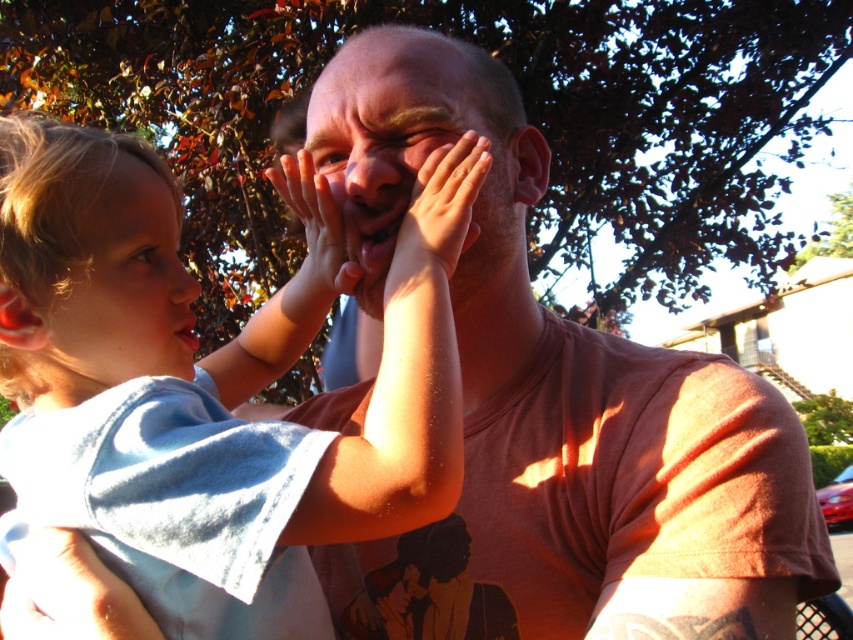
Question: Is light blue cotton shirt at left smaller than smooth bald head at center?

Choices:
 (A) yes
 (B) no

Answer: (B)

Question: Observing the image, what is the correct spatial positioning of light blue cotton shirt at left in reference to smooth skin hand at center?

Choices:
 (A) right
 (B) left

Answer: (B)

Question: Among these objects, which one is nearest to the camera?

Choices:
 (A) smooth skin face at center
 (B) blonde hair at left
 (C) matte orange t-shirt at center

Answer: (C)

Question: Considering the real-world distances, which object is closest to the smooth skin hand at center?

Choices:
 (A) blonde hair at left
 (B) smooth skin face at center
 (C) matte orange t-shirt at center
 (D) light blue cotton shirt at left

Answer: (B)

Question: Can you confirm if matte orange t-shirt at center is wider than smooth skin hand at center?

Choices:
 (A) no
 (B) yes

Answer: (B)

Question: Which point appears farthest from the camera in this image?

Choices:
 (A) (445, 608)
 (B) (408, 116)
 (C) (149, 256)

Answer: (A)